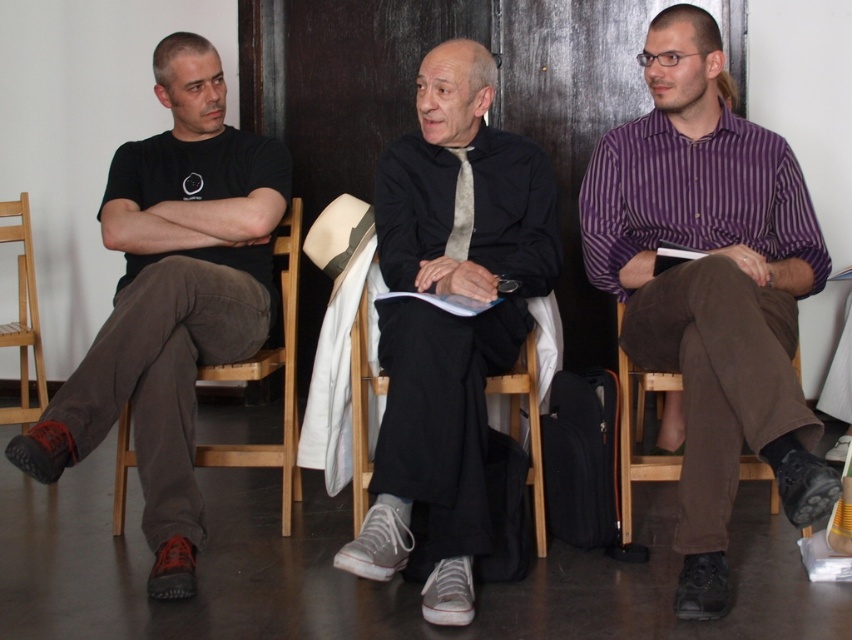
Consider the image. You are sitting in the brown fabric chair at right and want to pass a book to the person sitting in the light brown wooden chair at left. Which direction should you pass the book?

You should pass the book to the left because the light brown wooden chair at left is to the left of the brown fabric chair at right.

You are standing in front of the three people in the image. You want to hand a document to the person wearing the purple striped shirt at center without disturbing the person in the black matte shirt at center. Which direction should you approach from?

You should approach from the right side of the purple striped shirt at center since the purple striped shirt at center is positioned on the right side of the black matte shirt at center, meaning they are seated next to each other with the purple striped shirt at center to the right of the black matte shirt at center.